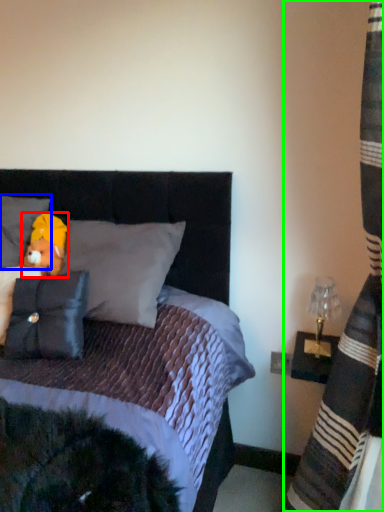
Question: Estimate the real-world distances between objects in this image. Which object is closer to figurine (highlighted by a red box), pillow (highlighted by a blue box) or curtain (highlighted by a green box)?

Choices:
 (A) pillow
 (B) curtain

Answer: (A)